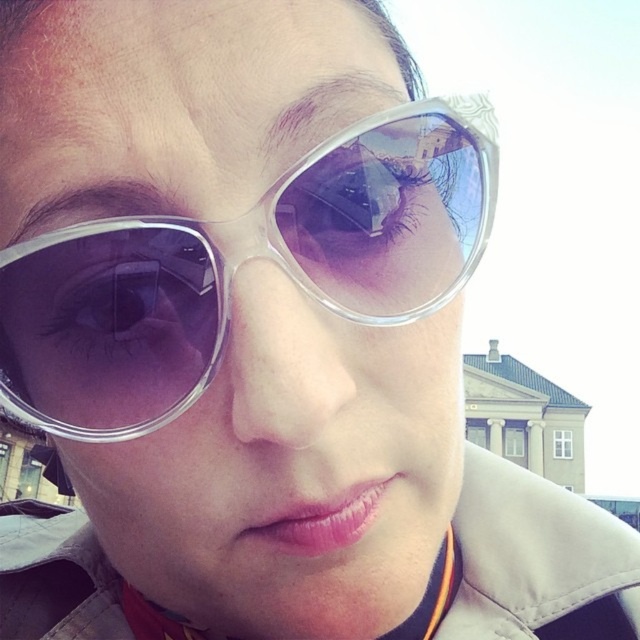
You are a photographer trying to capture a detailed shot of the point at coordinates point (422,128) in the scene. Given that your camera has a maximum focus range of 60 meters, will you be able to focus on that point?

The point (422,128) is 67.71 meters from the camera, which exceeds the maximum focus range of 60 meters. Therefore, the camera cannot focus on that point.

You are a fashion designer trying to create a new outfit. You have the transparent plastic sunglasses at center and the light beige fabric trench coat at center in your design. Which item is positioned closer to the viewer in the image?

The transparent plastic sunglasses at center is in front of the light beige fabric trench coat at center, so it is closer to the viewer.